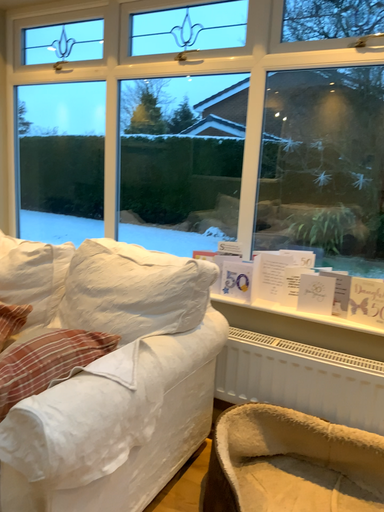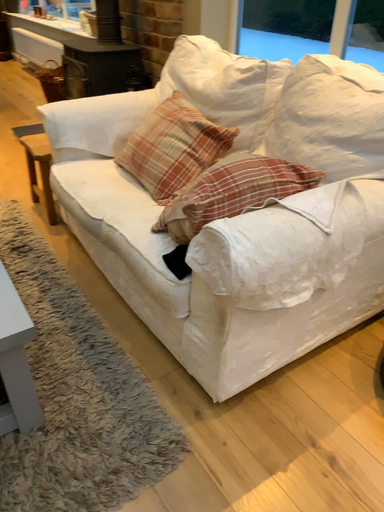
Question: Which way did the camera rotate in the video?

Choices:
 (A) rotated right
 (B) rotated left

Answer: (B)